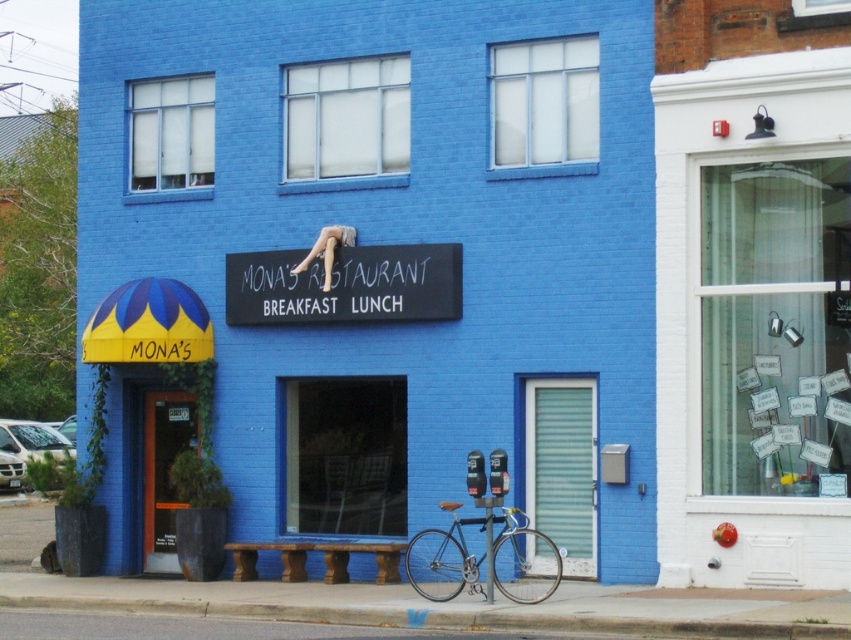
You are a painter hired to paint both the matte blue building at center and the white chalkboard sign at center. Which object requires more paint due to its larger width?

The white chalkboard sign at center requires more paint because it is wider than the matte blue building at center.

You are standing in front of Mona Restaurant and want to take a photo of the shiny silver bicycle at lower center and the matte blue building at center. Which object should you position to your left to include both in the frame?

You should position the shiny silver bicycle at lower center to your left because the matte blue building at center is to the right of it.

You are a delivery person trying to park your shiny silver bicycle at lower center near the entrance of the matte blue building at center. Can you tell me if the bicycle will fit under the awning without hitting the building?

The shiny silver bicycle at lower center is taller than the matte blue building at center. Since the awning is part of the building, the bicycle might hit the building if parked under the awning.